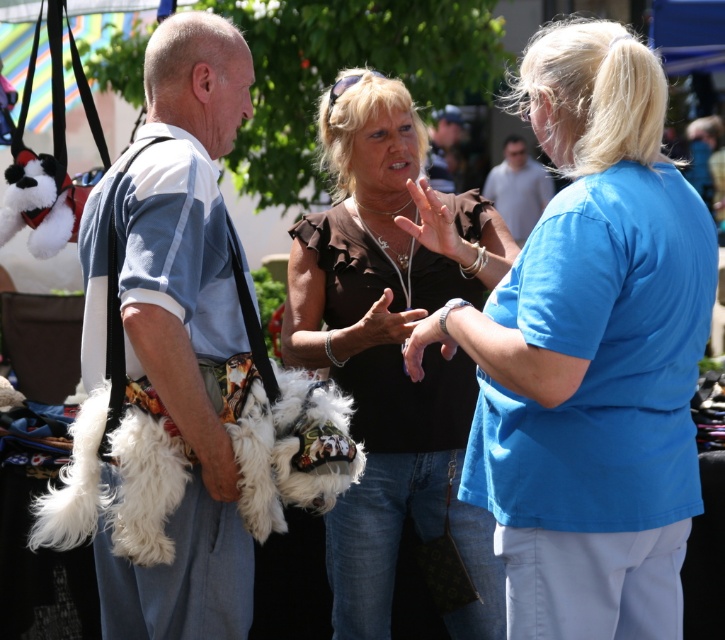
You are a shopper at the market and want to place your white fur bag at left and matte black purse at center on the checkout counter. Which one will have more vertical space when placed side by side?

The white fur bag at left is taller than the matte black purse at center, so it will occupy more vertical space when placed side by side.

You are a shopper at the market and see the white fur bag at left and the white fluffy dog at center. Which item is positioned higher in the image?

The white fur bag at left is positioned higher than the white fluffy dog at center.

You are a photographer at the market and want to capture both the blue cotton shirt at upper right and the brown ruffled shirt at center in a single photo. Which shirt should you focus on first to ensure both are in frame?

You should focus on the brown ruffled shirt at center first because the blue cotton shirt at upper right is in front of it, ensuring both will be visible in the photo.